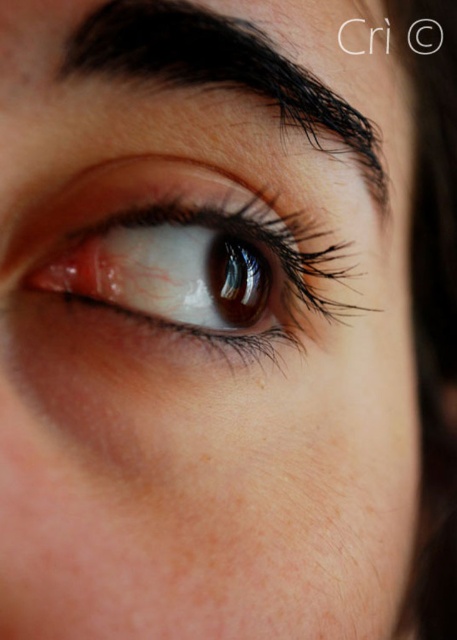
Looking at this image, is brown glossy eye at center thinner than brown hair at upper center?

No, brown glossy eye at center is not thinner than brown hair at upper center.

Who is more distant from viewer, (42,282) or (203,38)?

Positioned behind is point (42,282).

Locate an element on the screen. This screenshot has width=457, height=640. brown glossy eye at center is located at coordinates (181, 253).